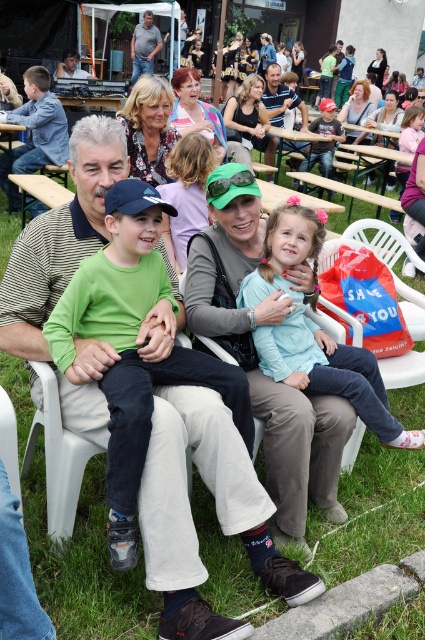
At what (x,y) coordinates should I click in order to perform the action: click on light blue fabric shirt at center. Please return your answer as a coordinate pair (x, y). The image size is (425, 640). Looking at the image, I should click on (314, 330).

Consider the image. Can you confirm if light blue fabric shirt at center is wider than denim jeans at upper center?

Indeed, light blue fabric shirt at center has a greater width compared to denim jeans at upper center.

Which is behind, point (294, 365) or point (133, 36)?

Point (133, 36)

Identify the location of light blue fabric shirt at center. This screenshot has height=640, width=425. (x=314, y=330).

Between green cotton shirt at center and light blue fabric shirt at center, which one is positioned lower?

green cotton shirt at center is below.

Is green cotton shirt at center below light blue fabric shirt at center?

Yes.

What do you see at coordinates (133, 349) in the screenshot?
I see `green cotton shirt at center` at bounding box center [133, 349].

What are the coordinates of `green cotton shirt at center` in the screenshot? It's located at (133, 349).

Based on the photo, is green cotton shirt at center shorter than smooth brown shirt at center?

Yes.

Who is shorter, green cotton shirt at center or smooth brown shirt at center?

green cotton shirt at center is shorter.

This screenshot has height=640, width=425. Find the location of `green cotton shirt at center`. green cotton shirt at center is located at coordinates (133, 349).